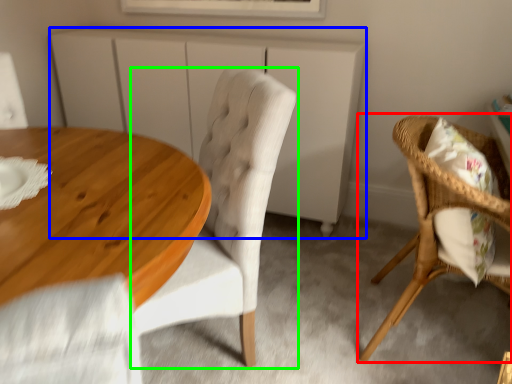
Question: Based on their relative distances, which object is farther from chair (highlighted by a red box)? Choose from cabinetry (highlighted by a blue box) and chair (highlighted by a green box).

Choices:
 (A) cabinetry
 (B) chair

Answer: (A)